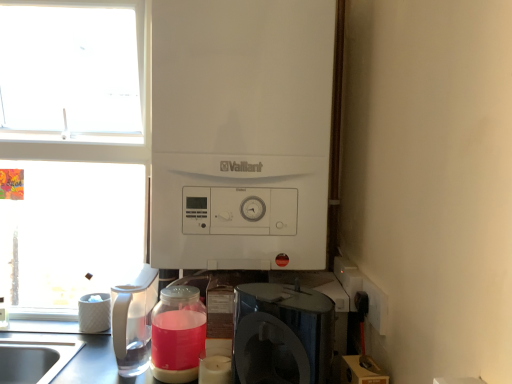
Question: Can we say white matte boiler at center, which appears as the second appliance when viewed from the left, lies outside satin black coffee maker at lower center?

Choices:
 (A) no
 (B) yes

Answer: (B)

Question: Is white matte boiler at center, which is the 1th appliance in top-to-bottom order, oriented away from satin black coffee maker at lower center?

Choices:
 (A) yes
 (B) no

Answer: (B)

Question: Is white matte boiler at center, which is the 1th appliance from front to back, further to camera compared to satin black coffee maker at lower center?

Choices:
 (A) yes
 (B) no

Answer: (A)

Question: Can you confirm if white matte boiler at center, the second appliance positioned from the back, is taller than satin black coffee maker at lower center?

Choices:
 (A) yes
 (B) no

Answer: (A)

Question: Does white matte boiler at center, the 1th appliance in the right-to-left sequence, have a lesser height compared to satin black coffee maker at lower center?

Choices:
 (A) yes
 (B) no

Answer: (B)

Question: From the image's perspective, is white matte window at upper left positioned above or below satin black coffee maker at lower center?

Choices:
 (A) below
 (B) above

Answer: (B)

Question: Is white matte window at upper left inside or outside of satin black coffee maker at lower center?

Choices:
 (A) outside
 (B) inside

Answer: (A)

Question: Considering the positions of white matte window at upper left and satin black coffee maker at lower center in the image, is white matte window at upper left wider or thinner than satin black coffee maker at lower center?

Choices:
 (A) thin
 (B) wide

Answer: (B)

Question: Considering the positions of point pyautogui.click(x=24, y=84) and point pyautogui.click(x=292, y=317), is point pyautogui.click(x=24, y=84) closer or farther from the camera than point pyautogui.click(x=292, y=317)?

Choices:
 (A) closer
 (B) farther

Answer: (B)

Question: From the image's perspective, relative to white textured container at left, the 2th appliance in the front-to-back sequence, is white plastic electric outlet at lower right above or below?

Choices:
 (A) below
 (B) above

Answer: (B)

Question: Considering the positions of white plastic electric outlet at lower right and white textured container at left, marked as the 1th appliance in a bottom-to-top arrangement, in the image, is white plastic electric outlet at lower right taller or shorter than white textured container at left, marked as the 1th appliance in a bottom-to-top arrangement,?

Choices:
 (A) short
 (B) tall

Answer: (A)

Question: Relative to white textured container at left, marked as the 1th appliance in a bottom-to-top arrangement, is white plastic electric outlet at lower right in front or behind?

Choices:
 (A) front
 (B) behind

Answer: (A)

Question: Is point (373, 291) closer or farther from the camera than point (83, 309)?

Choices:
 (A) farther
 (B) closer

Answer: (B)

Question: From the image's perspective, relative to clear plastic pitcher at left, is white matte window at upper left above or below?

Choices:
 (A) above
 (B) below

Answer: (A)

Question: From a real-world perspective, is white matte window at upper left positioned above or below clear plastic pitcher at left?

Choices:
 (A) above
 (B) below

Answer: (A)